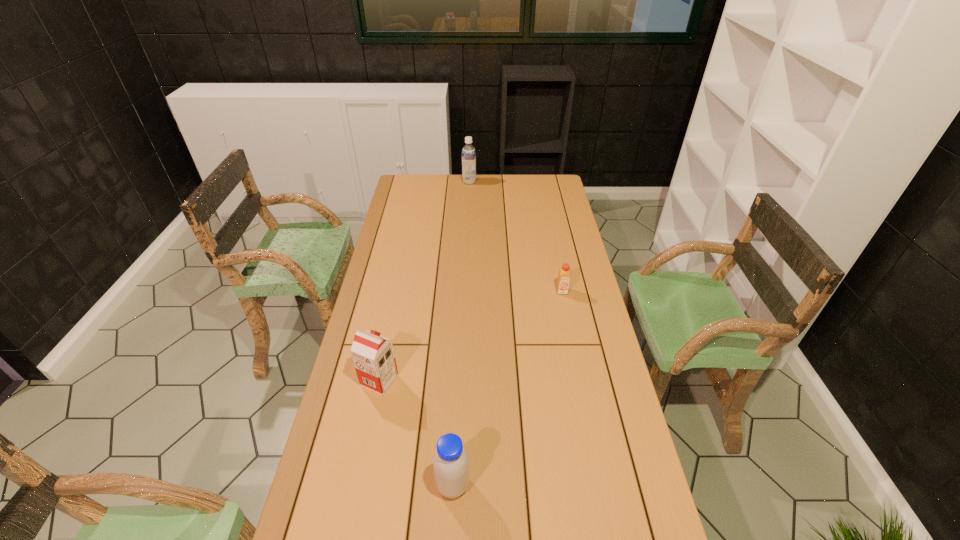
This screenshot has width=960, height=540. I want to click on object that is at the far edge, so click(x=468, y=152).

Where is `object at the left edge`? object at the left edge is located at coordinates (373, 355).

What are the coordinates of `object situated at the right edge` in the screenshot? It's located at (564, 273).

You are a GUI agent. You are given a task and a screenshot of the screen. Output one action in this format:
    pyautogui.click(x=<x>, y=<y>)
    Task: Click on the vacant area at the far edge of the desktop
    The width and height of the screenshot is (960, 540).
    Given the screenshot: What is the action you would take?
    pyautogui.click(x=446, y=184)

This screenshot has width=960, height=540. I want to click on vacant space at the left edge, so click(373, 314).

Identify the location of free space at the right edge of the desktop. This screenshot has width=960, height=540. (583, 262).

Where is `vacant point at the far right corner`? Image resolution: width=960 pixels, height=540 pixels. vacant point at the far right corner is located at coordinates 553,178.

Locate an element on the screen. The image size is (960, 540). free point between the leftmost object and the nearest object is located at coordinates (417, 433).

Where is `vacant point located between the nearest object and the leftmost soya milk`? The width and height of the screenshot is (960, 540). vacant point located between the nearest object and the leftmost soya milk is located at coordinates (417, 433).

The image size is (960, 540). Find the location of `vacant space in between the farthest object and the orange juice`. vacant space in between the farthest object and the orange juice is located at coordinates (516, 236).